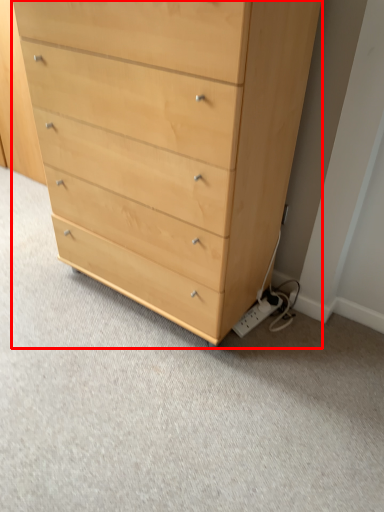
Question: From the image's perspective, where is chest of drawers (annotated by the red box) located in relation to electric outlet in the image?

Choices:
 (A) above
 (B) below

Answer: (A)